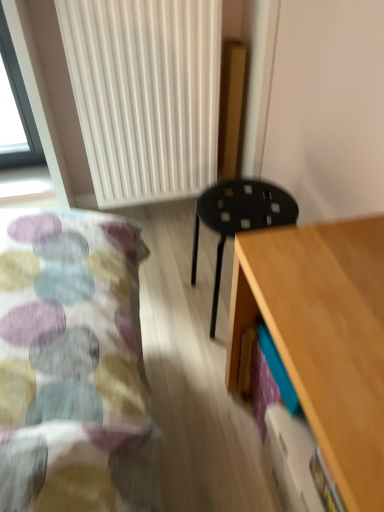
Question: Is black plastic stool at center behind white ribbed radiator at upper center?

Choices:
 (A) no
 (B) yes

Answer: (A)

Question: Is black plastic stool at center oriented towards white ribbed radiator at upper center?

Choices:
 (A) yes
 (B) no

Answer: (B)

Question: Is black plastic stool at center turned away from white ribbed radiator at upper center?

Choices:
 (A) no
 (B) yes

Answer: (A)

Question: From a real-world perspective, is black plastic stool at center located higher than white ribbed radiator at upper center?

Choices:
 (A) yes
 (B) no

Answer: (B)

Question: Would you consider black plastic stool at center to be distant from white ribbed radiator at upper center?

Choices:
 (A) yes
 (B) no

Answer: (B)

Question: Is white ribbed radiator at upper center a part of black plastic stool at center?

Choices:
 (A) no
 (B) yes

Answer: (A)

Question: Is light wood desk at lower right taller than white ribbed radiator at upper center?

Choices:
 (A) no
 (B) yes

Answer: (A)

Question: Could you tell me if light wood desk at lower right is turned towards white ribbed radiator at upper center?

Choices:
 (A) yes
 (B) no

Answer: (B)

Question: From a real-world perspective, is light wood desk at lower right physically above white ribbed radiator at upper center?

Choices:
 (A) yes
 (B) no

Answer: (B)

Question: Does light wood desk at lower right appear on the right side of white ribbed radiator at upper center?

Choices:
 (A) yes
 (B) no

Answer: (A)

Question: Considering the relative positions of light wood desk at lower right and white ribbed radiator at upper center in the image provided, is light wood desk at lower right in front of white ribbed radiator at upper center?

Choices:
 (A) yes
 (B) no

Answer: (A)

Question: Is light wood desk at lower right not inside white ribbed radiator at upper center?

Choices:
 (A) no
 (B) yes

Answer: (B)

Question: From the image's perspective, is white ribbed radiator at upper center on light wood desk at lower right?

Choices:
 (A) yes
 (B) no

Answer: (A)